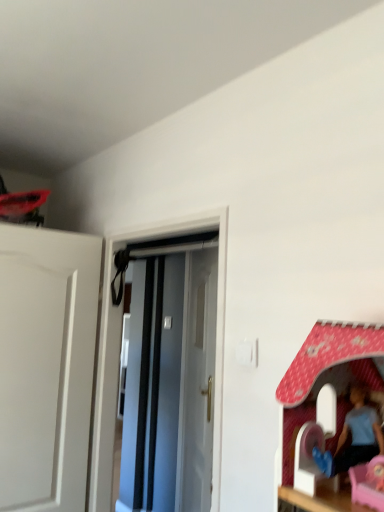
Question: From a real-world perspective, is white glossy door at center, marked as the second door in a back-to-front arrangement, positioned above or below white glossy door at center, the 2th door when ordered from front to back?

Choices:
 (A) below
 (B) above

Answer: (B)

Question: Relative to white glossy door at center, placed as the 1th door when sorted from back to front, is white glossy door at center, marked as the second door in a back-to-front arrangement, in front or behind?

Choices:
 (A) behind
 (B) front

Answer: (B)

Question: From the image's perspective, is white glossy door at center, which is the 1th door in front-to-back order, located above or below white glossy door at center, the 2th door when ordered from front to back?

Choices:
 (A) below
 (B) above

Answer: (B)

Question: Considering the positions of white glossy door at center, placed as the 1th door when sorted from back to front, and white glossy door at center, which is the 1th door in front-to-back order, in the image, is white glossy door at center, placed as the 1th door when sorted from back to front, wider or thinner than white glossy door at center, which is the 1th door in front-to-back order,?

Choices:
 (A) thin
 (B) wide

Answer: (A)

Question: From a real-world perspective, is white glossy door at center, placed as the 1th door when sorted from back to front, positioned above or below white glossy door at center, marked as the second door in a back-to-front arrangement?

Choices:
 (A) below
 (B) above

Answer: (A)

Question: In the image, is white glossy door at center, the 2th door when ordered from front to back, positioned in front of or behind white glossy door at center, which is the 1th door in front-to-back order?

Choices:
 (A) behind
 (B) front

Answer: (A)

Question: From the image's perspective, is white glossy door at center, the 2th door when ordered from front to back, positioned above or below white glossy door at center, which is the 1th door in front-to-back order?

Choices:
 (A) below
 (B) above

Answer: (A)